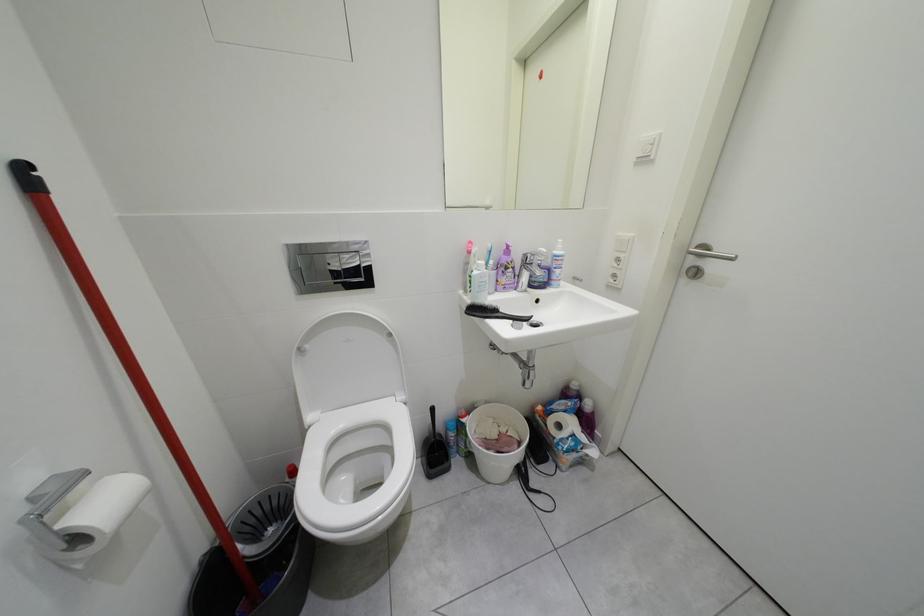
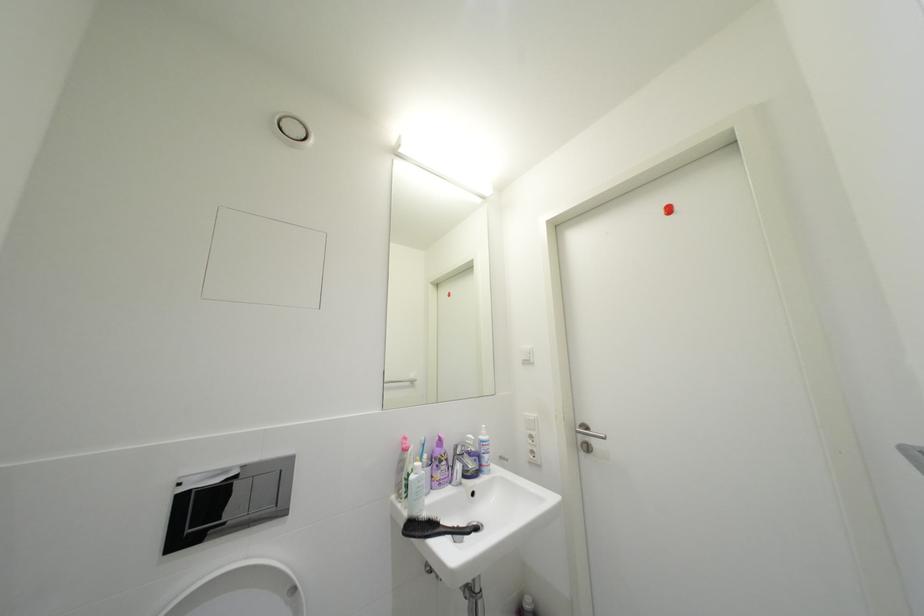
The images are taken continuously from a first-person perspective. In which direction is your viewpoint rotating?

The camera's rotation is toward right-up.